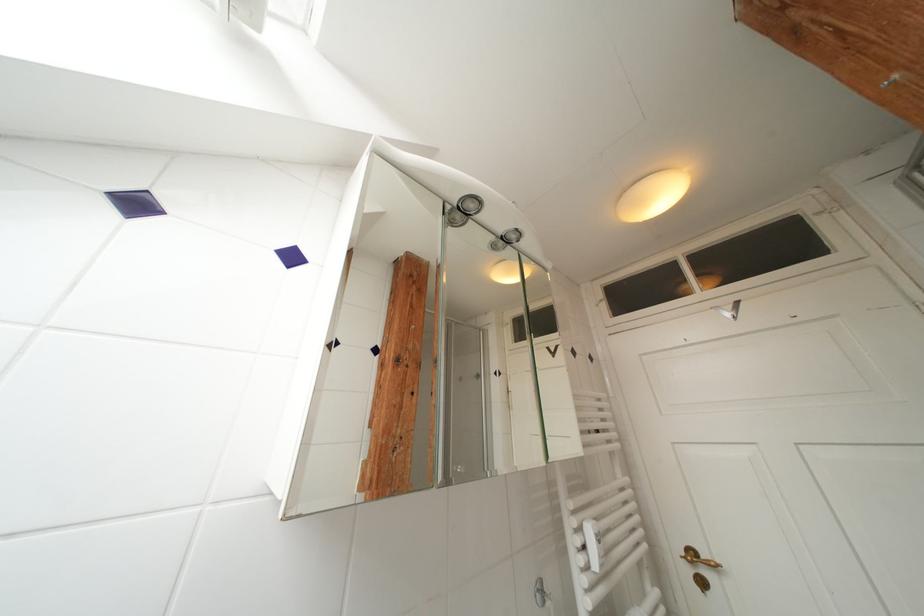
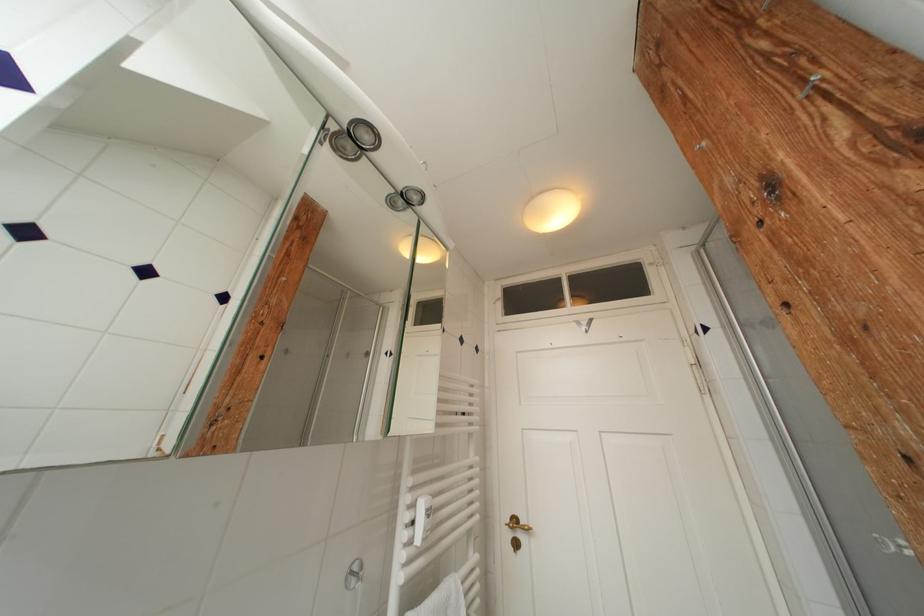
The point at (616,444) is marked in the first image. Where is the corresponding point in the second image?

(478, 427)